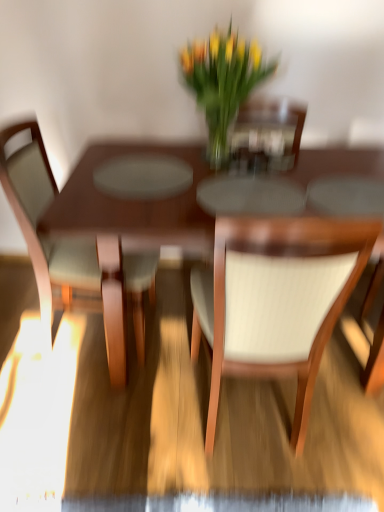
Question: From the image's perspective, does wooden table at center appear higher than light brown wood chair at left, the second chair from the right?

Choices:
 (A) yes
 (B) no

Answer: (B)

Question: Does wooden table at center have a greater height compared to light brown wood chair at left, marked as the first chair in a left-to-right arrangement?

Choices:
 (A) yes
 (B) no

Answer: (B)

Question: Could you tell me if wooden table at center is facing light brown wood chair at left, the second chair from the right?

Choices:
 (A) no
 (B) yes

Answer: (A)

Question: Is wooden table at center turned away from light brown wood chair at left, the second chair from the right?

Choices:
 (A) no
 (B) yes

Answer: (A)

Question: Does wooden table at center have a smaller size compared to light brown wood chair at left, the second chair from the right?

Choices:
 (A) yes
 (B) no

Answer: (B)

Question: From a real-world perspective, is wooden table at center on top of light brown wood chair at left, the second chair from the right?

Choices:
 (A) no
 (B) yes

Answer: (A)

Question: Is white textured chair at center, the 1th chair in the right-to-left sequence, at the right side of wooden table at center?

Choices:
 (A) no
 (B) yes

Answer: (B)

Question: Are white textured chair at center, which appears as the second chair when viewed from the left, and wooden table at center far apart?

Choices:
 (A) no
 (B) yes

Answer: (A)

Question: From the image's perspective, is white textured chair at center, the 1th chair in the right-to-left sequence, located above wooden table at center?

Choices:
 (A) yes
 (B) no

Answer: (B)

Question: Does white textured chair at center, the 1th chair in the right-to-left sequence, have a greater height compared to wooden table at center?

Choices:
 (A) yes
 (B) no

Answer: (A)

Question: Can you confirm if white textured chair at center, which appears as the second chair when viewed from the left, is thinner than wooden table at center?

Choices:
 (A) no
 (B) yes

Answer: (B)

Question: Does white textured chair at center, which appears as the second chair when viewed from the left, lie in front of wooden table at center?

Choices:
 (A) no
 (B) yes

Answer: (B)

Question: From the image's perspective, does light brown wood chair at left, marked as the first chair in a left-to-right arrangement, appear lower than white textured chair at center, which appears as the second chair when viewed from the left?

Choices:
 (A) no
 (B) yes

Answer: (A)